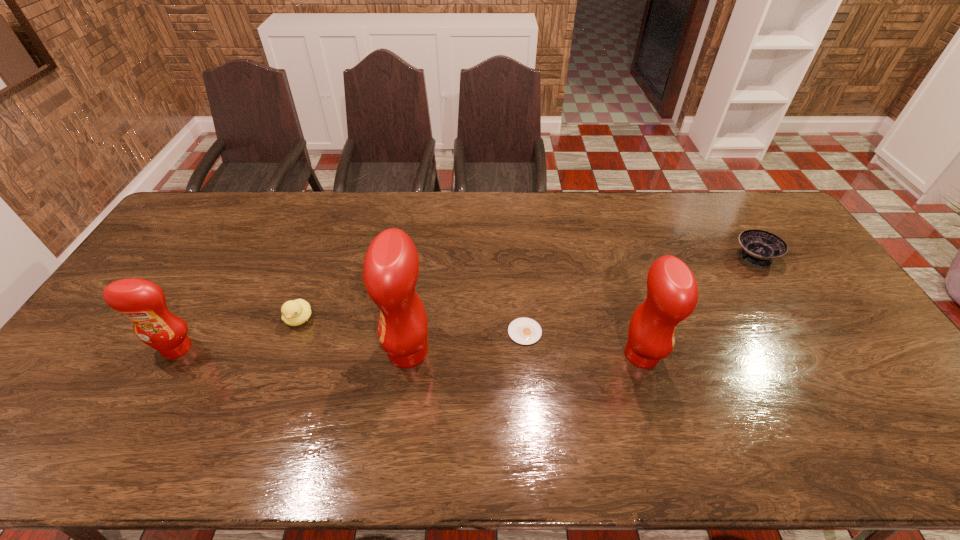
This screenshot has height=540, width=960. I want to click on free spot at the far edge of the desktop, so (x=632, y=199).

In the image, there is a desktop. Where is `vacant space at the near edge`? This screenshot has width=960, height=540. vacant space at the near edge is located at coordinates (540, 414).

Image resolution: width=960 pixels, height=540 pixels. I want to click on vacant area at the right edge, so [x=828, y=335].

This screenshot has width=960, height=540. What are the coordinates of `vacant space at the near left corner of the desktop` in the screenshot? It's located at (97, 409).

Where is `free area in between the tallest condiment and the fifth object from left to right`? free area in between the tallest condiment and the fifth object from left to right is located at coordinates (525, 353).

I want to click on free spot between the duckling and the leftmost condiment, so click(238, 334).

Locate an element on the screen. unoccupied area between the tallest object and the rightmost condiment is located at coordinates (525, 353).

Identify the location of vacant area that lies between the tallest condiment and the leftmost condiment. (293, 350).

Find the location of a particular element. vacant area that lies between the third object from left to right and the second shortest object is located at coordinates (581, 305).

You are a GUI agent. You are given a task and a screenshot of the screen. Output one action in this format:
    pyautogui.click(x=<x>, y=<y>)
    Task: Click on the unoccupied area between the second tallest condiment and the duckling
    The image size is (960, 540).
    Given the screenshot: What is the action you would take?
    pyautogui.click(x=470, y=337)